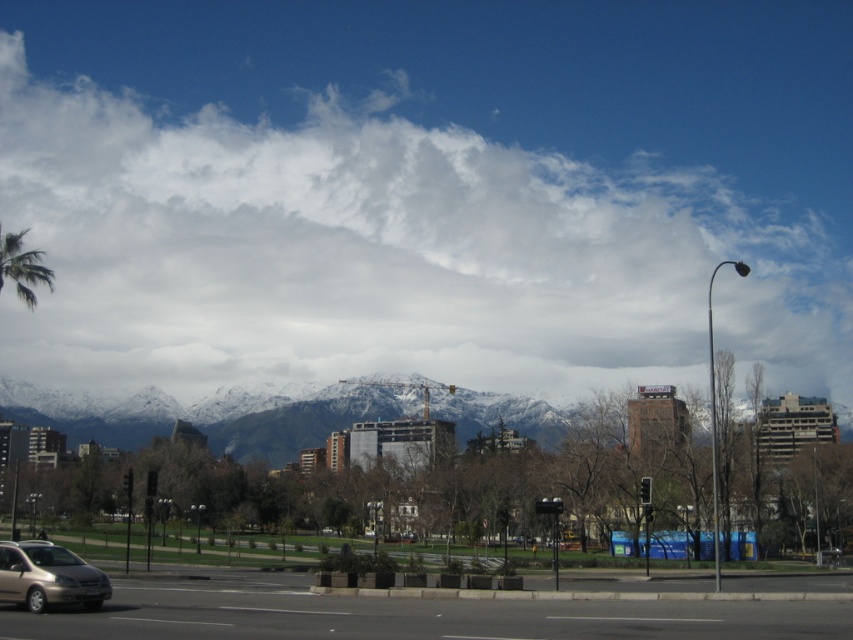
Question: Which point is closer to the camera?

Choices:
 (A) white fluffy cloud at upper center
 (B) gold metallic van at lower left

Answer: (B)

Question: Does white fluffy cloud at upper center come behind gold metallic van at lower left?

Choices:
 (A) no
 (B) yes

Answer: (B)

Question: Estimate the real-world distances between objects in this image. Which object is farther from the green leafy palm tree at left?

Choices:
 (A) snowy mountain range at center
 (B) white fluffy cloud at upper center
 (C) gold metallic van at lower left

Answer: (B)

Question: Is gold metallic van at lower left thinner than green leafy palm tree at left?

Choices:
 (A) yes
 (B) no

Answer: (A)

Question: Which point is closer to the camera?

Choices:
 (A) (456, 394)
 (B) (682, 246)
 (C) (39, 257)

Answer: (C)

Question: Does snowy mountain range at center appear on the right side of green leafy palm tree at left?

Choices:
 (A) no
 (B) yes

Answer: (B)